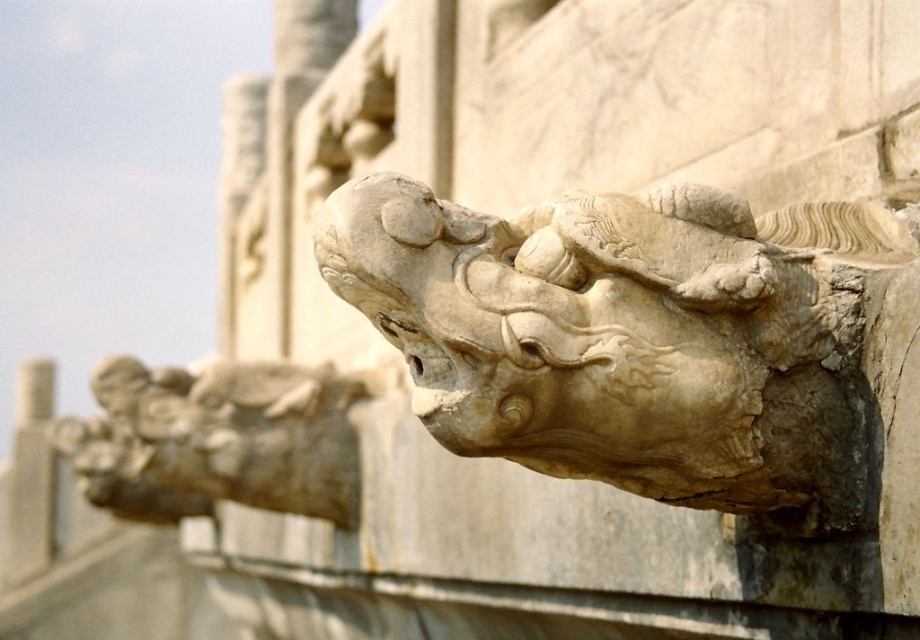
Between white stone dragon at upper center and white stone dragon at upper left, which one appears on the right side from the viewer's perspective?

From the viewer's perspective, white stone dragon at upper center appears more on the right side.

Is point (658, 472) closer to camera compared to point (150, 376)?

Yes.

What do you see at coordinates (631, 337) in the screenshot? I see `white stone dragon at upper center` at bounding box center [631, 337].

Find the location of a particular element. This screenshot has width=920, height=640. white stone dragon at upper center is located at coordinates (631, 337).